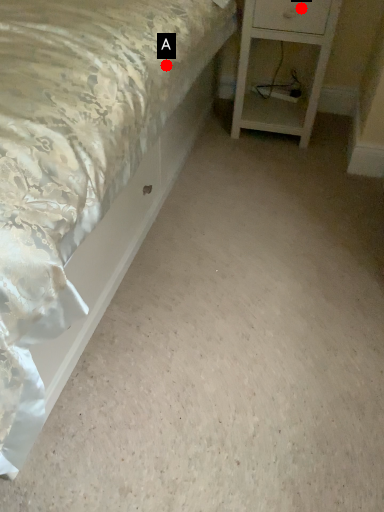
Question: Two points are circled on the image, labeled by A and B beside each circle. Which point is further to the camera?

Choices:
 (A) A is further
 (B) B is further

Answer: (B)